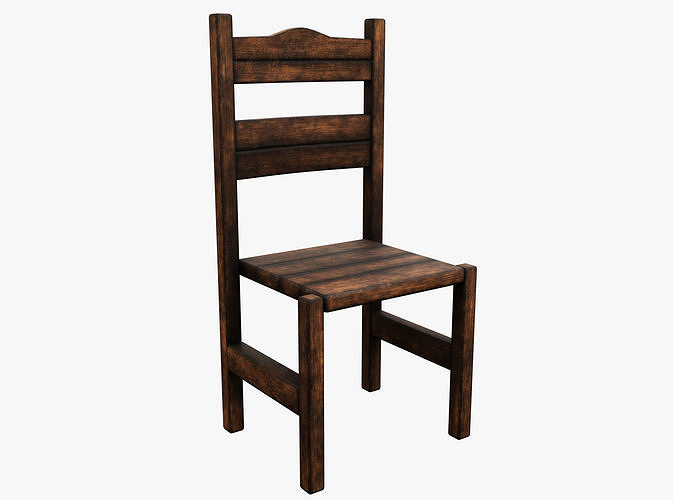
Where is `the right front leg`? the right front leg is located at coordinates (316, 432).